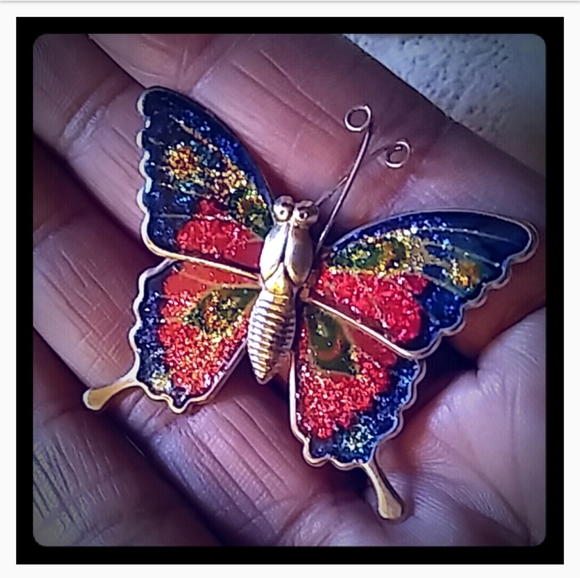
Where is `floor`? Image resolution: width=580 pixels, height=578 pixels. floor is located at coordinates (512, 97).